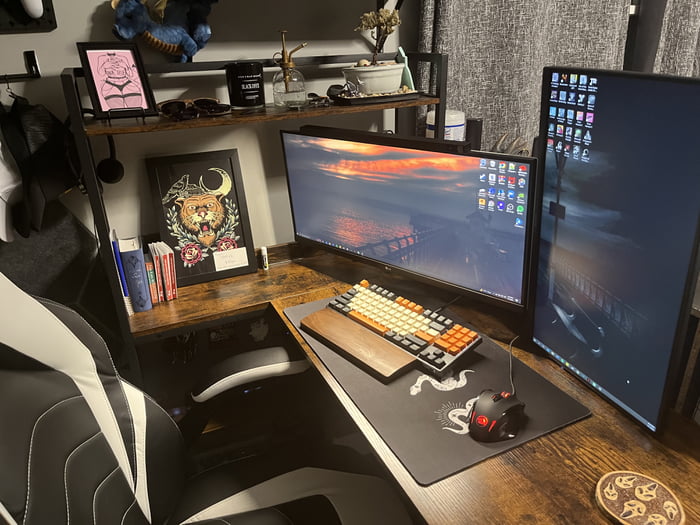
Where is `handrest`? This screenshot has height=525, width=700. handrest is located at coordinates (358, 346).